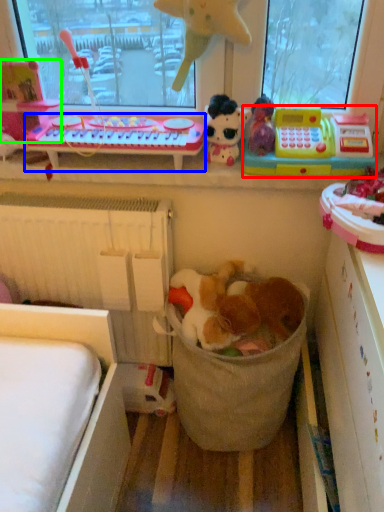
Question: Which object is positioned farthest from toy (highlighted by a red box)? Select from changing table (highlighted by a blue box) and toy (highlighted by a green box).

Choices:
 (A) changing table
 (B) toy

Answer: (B)